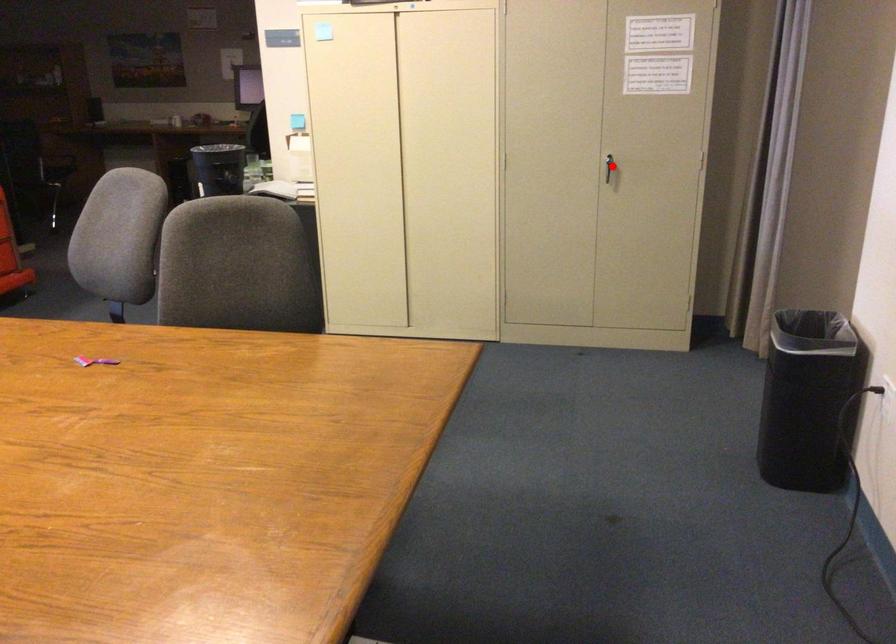
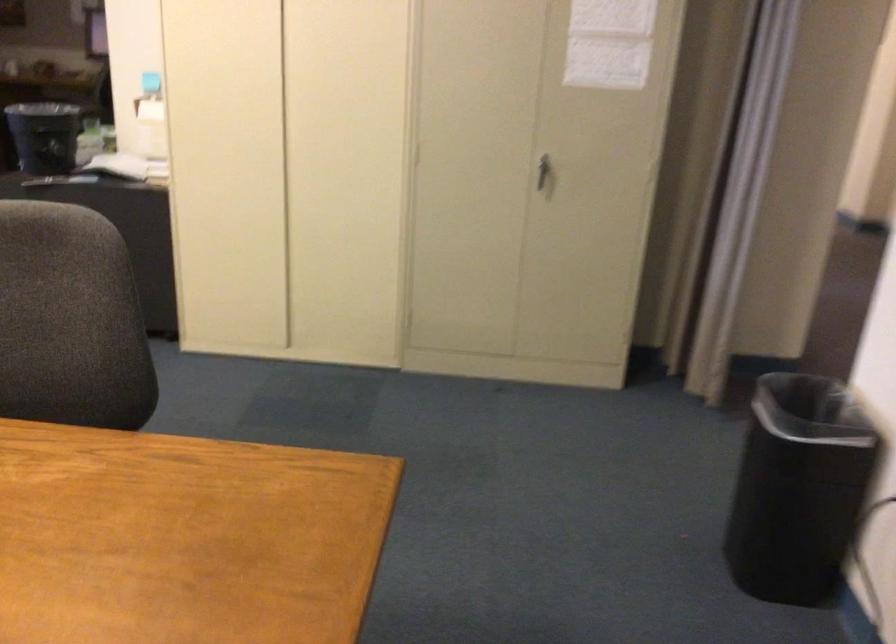
The point at the highlighted location is marked in the first image. Where is the corresponding point in the second image?

(544, 172)